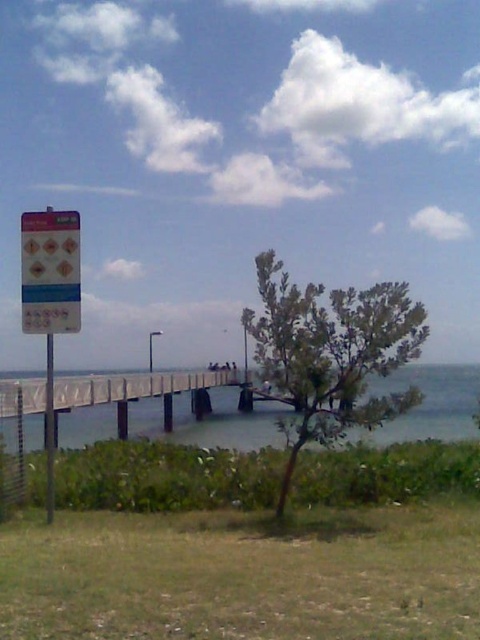
Question: Does blue plastic sign at left lie behind metallic pole at left?

Choices:
 (A) no
 (B) yes

Answer: (A)

Question: Which of the following is the farthest from the observer?

Choices:
 (A) (256, 424)
 (B) (182, 381)
 (C) (80, 248)
 (D) (52, 340)

Answer: (B)

Question: Is purple plastic sign at left closer to the viewer compared to wooden dock at center?

Choices:
 (A) no
 (B) yes

Answer: (B)

Question: Which of the following is the closest to the observer?

Choices:
 (A) (170, 410)
 (B) (64, 224)
 (C) (72, 298)

Answer: (C)

Question: Which point is closer to the camera?

Choices:
 (A) metallic pole at left
 (B) blue plastic sign at left
 (C) wooden dock at center

Answer: (B)

Question: Is clear blue water at center further to the viewer compared to purple plastic sign at left?

Choices:
 (A) no
 (B) yes

Answer: (B)